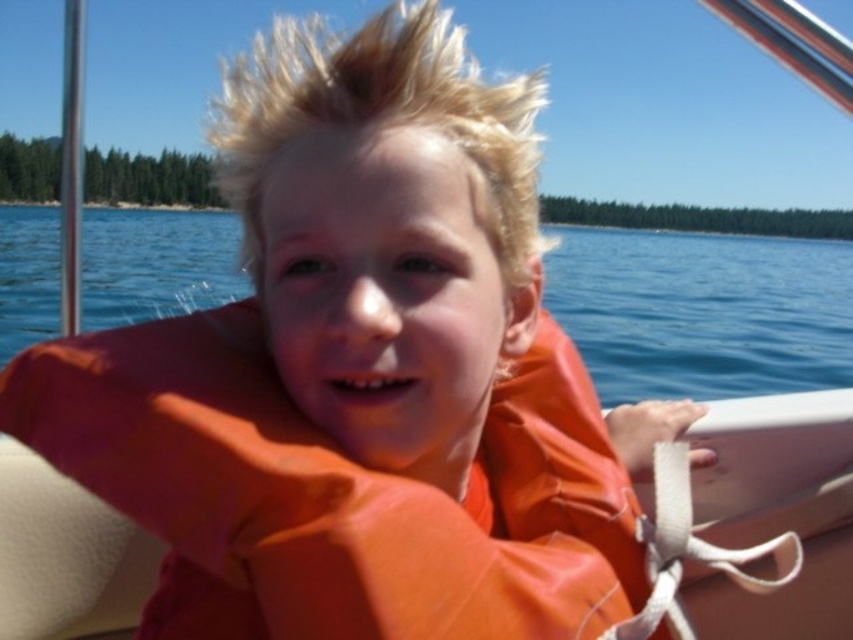
Question: Is orange matte life jacket at center in front of blue water at center?

Choices:
 (A) yes
 (B) no

Answer: (A)

Question: Which point is farther to the camera?

Choices:
 (A) (718, 372)
 (B) (231, 625)

Answer: (A)

Question: Can you confirm if orange matte life jacket at center is bigger than blue water at center?

Choices:
 (A) no
 (B) yes

Answer: (A)

Question: Can you confirm if orange matte life jacket at center is positioned to the left of blue water at center?

Choices:
 (A) yes
 (B) no

Answer: (B)

Question: Which point is closer to the camera?

Choices:
 (A) blue water at center
 (B) orange matte life jacket at center

Answer: (B)